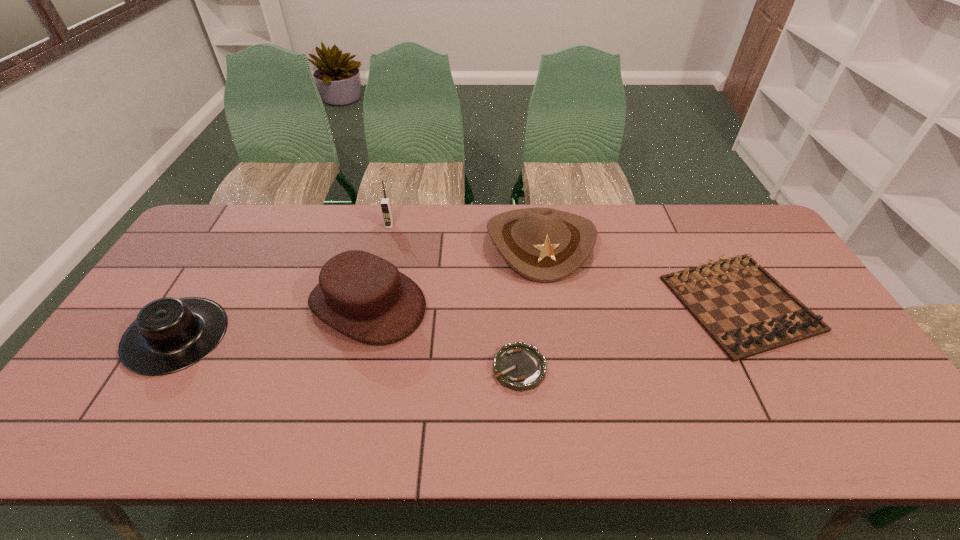
Identify the location of blank area located on the right of the taller dress hat. (539, 304).

The image size is (960, 540). In order to click on vacant area located on the back of the shorter dress hat in this screenshot , I will do `click(217, 269)`.

Locate an element on the screen. vacant region located on the back of the chessboard is located at coordinates (707, 244).

At what (x,y) coordinates should I click in order to perform the action: click on vacant area situated 0.100m on the front of the ashtray. Please return your answer as a coordinate pair (x, y). This screenshot has height=540, width=960. Looking at the image, I should click on (524, 431).

The height and width of the screenshot is (540, 960). Identify the location of cellular telephone that is at the far edge. (385, 203).

Find the location of a particular element. cowboy hat that is at the far edge is located at coordinates (545, 245).

Find the location of `object that is at the left edge`. object that is at the left edge is located at coordinates (169, 334).

This screenshot has width=960, height=540. Identify the location of object present at the right edge. click(744, 309).

What are the coordinates of `free location at the far edge of the desktop` in the screenshot? It's located at (364, 246).

The height and width of the screenshot is (540, 960). I want to click on blank space at the near edge of the desktop, so click(833, 440).